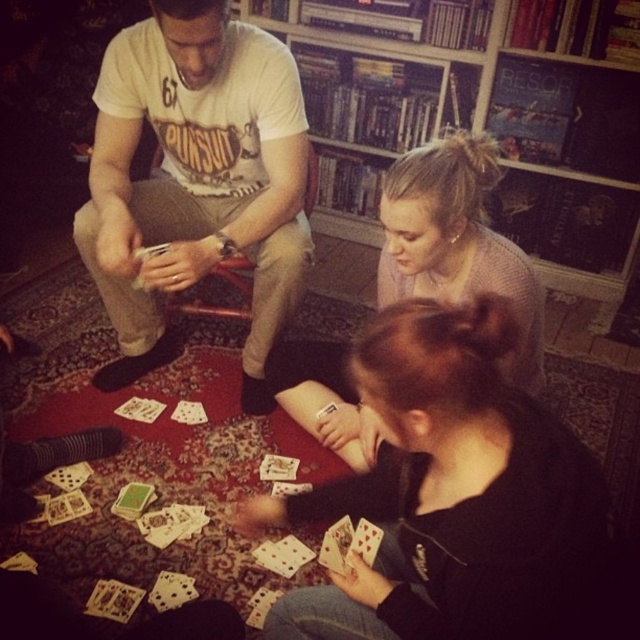
You are standing in the living room and want to reach the point marked as point (547, 589). If you take a step forward of 1 meter, will you pass the point?

The point (547, 589) is 81.17 centimeters from the viewer. Since you are stepping forward 1 meter, which is longer than 81.17 centimeters, you will pass the point.